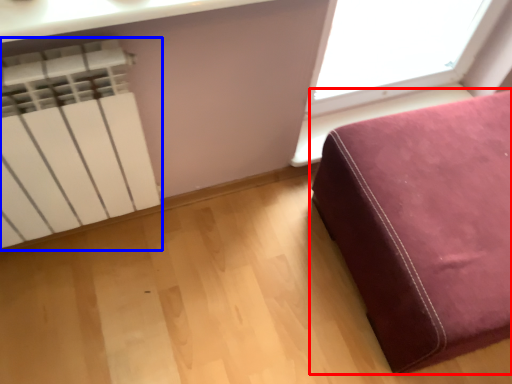
Question: Which of the following is the closest to the observer, furniture (highlighted by a red box) or radiator (highlighted by a blue box)?

Choices:
 (A) furniture
 (B) radiator

Answer: (B)